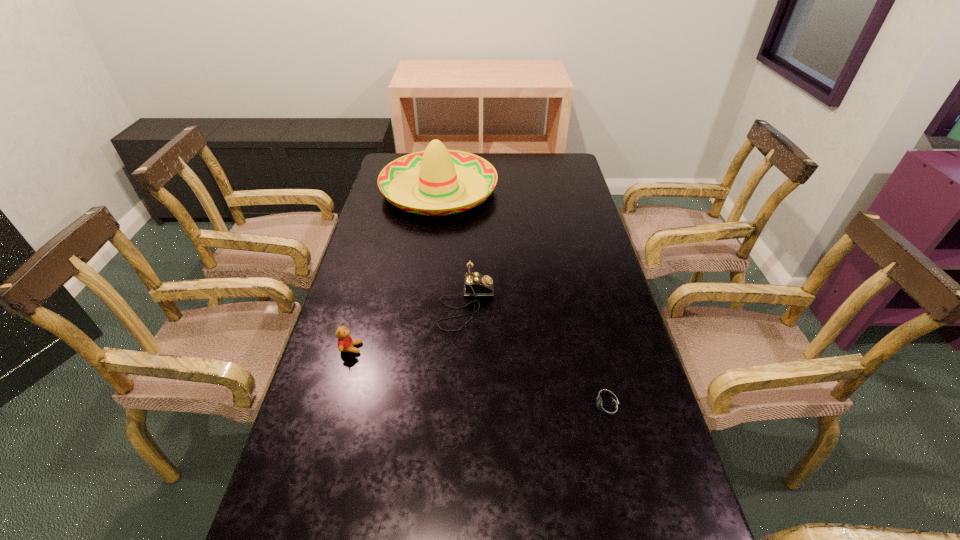
The image size is (960, 540). Identify the location of vacant space at the far right corner of the desktop. (553, 163).

The width and height of the screenshot is (960, 540). Identify the location of free space between the watch and the third nearest object. click(537, 356).

In order to click on vacant space that is in between the shortest object and the teddy bear in this screenshot , I will do `click(479, 377)`.

Locate an element on the screen. vacant region between the second nearest object and the nearest object is located at coordinates (479, 377).

Locate an element on the screen. vacant area that lies between the telephone and the watch is located at coordinates (537, 356).

I want to click on vacant space that is in between the rightmost object and the telephone, so click(537, 356).

Identify the location of blank region between the telephone and the nearest object. (537, 356).

Identify the location of free space between the shortest object and the second farthest object. (537, 356).

Identify the location of vacant point located between the third farthest object and the rightmost object. Image resolution: width=960 pixels, height=540 pixels. (479, 377).

At what (x,y) coordinates should I click in order to perform the action: click on free space between the telephone and the third farthest object. Please return your answer as a coordinate pair (x, y). This screenshot has width=960, height=540. Looking at the image, I should click on (409, 327).